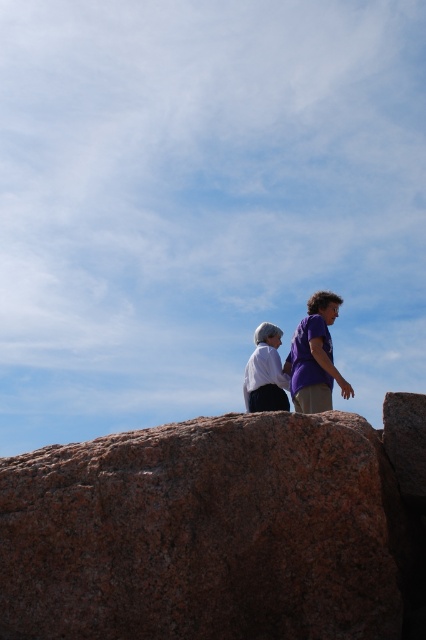
Question: Which object is positioned closest to the granite rock at center?

Choices:
 (A) purple matte shirt at center
 (B) white matte shirt at center

Answer: (A)

Question: Is purple matte shirt at center positioned before white matte shirt at center?

Choices:
 (A) yes
 (B) no

Answer: (A)

Question: Is purple matte shirt at center further to camera compared to white matte shirt at center?

Choices:
 (A) no
 (B) yes

Answer: (A)

Question: Which object appears closest to the camera in this image?

Choices:
 (A) granite rock at center
 (B) purple matte shirt at center
 (C) white matte shirt at center

Answer: (A)

Question: Which of the following is the farthest from the observer?

Choices:
 (A) purple matte shirt at center
 (B) granite rock at center
 (C) white matte shirt at center

Answer: (C)

Question: Is granite rock at center thinner than white matte shirt at center?

Choices:
 (A) yes
 (B) no

Answer: (B)